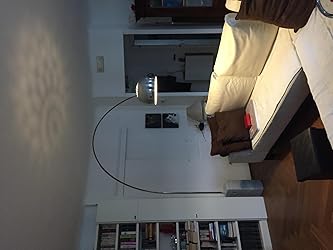
Locate an element on the screen. lamp is located at coordinates (147, 96).